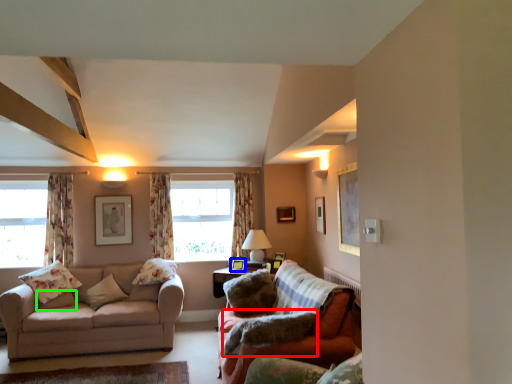
Question: Based on their relative distances, which object is nearer to pillow (highlighted by a red box)? Choose from picture frame (highlighted by a blue box) and pillow (highlighted by a green box).

Choices:
 (A) picture frame
 (B) pillow

Answer: (A)